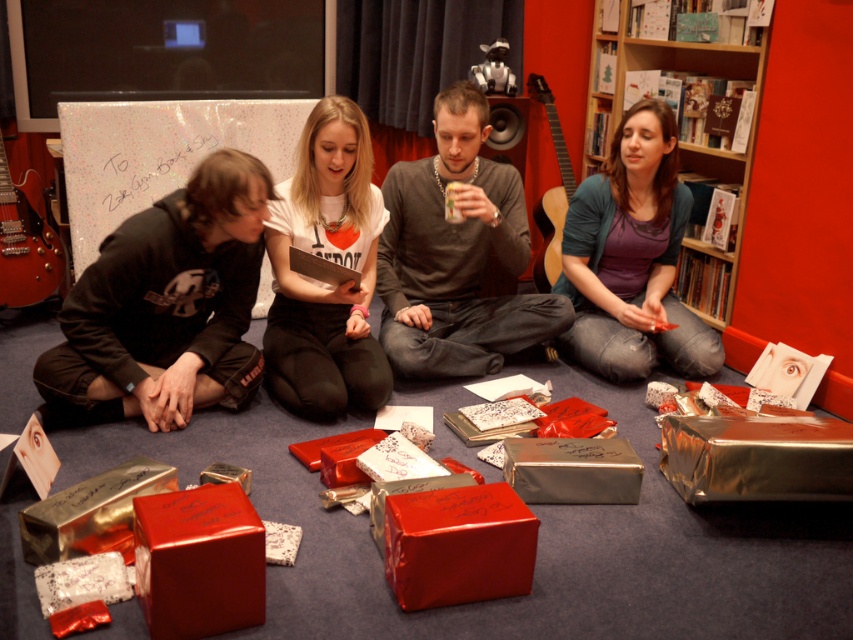
Between matte black hoodie at left and wooden bookshelf at upper center, which one appears on the left side from the viewer's perspective?

From the viewer's perspective, matte black hoodie at left appears more on the left side.

Is matte black hoodie at left bigger than wooden bookshelf at upper center?

No.

Between point (149, 273) and point (650, 67), which one is positioned behind?

Point (650, 67)

The width and height of the screenshot is (853, 640). I want to click on matte black hoodie at left, so click(x=166, y=305).

Where is `matte purple shirt at center`? The width and height of the screenshot is (853, 640). matte purple shirt at center is located at coordinates (631, 259).

Is matte purple shirt at center wider than shiny red box at center?

Correct, the width of matte purple shirt at center exceeds that of shiny red box at center.

Where is `matte purple shirt at center`? matte purple shirt at center is located at coordinates (631, 259).

Between point (155, 388) and point (445, 323), which one is positioned behind?

Positioned behind is point (445, 323).

The image size is (853, 640). Describe the element at coordinates (166, 305) in the screenshot. I see `matte black hoodie at left` at that location.

This screenshot has height=640, width=853. Identify the location of matte black hoodie at left. (166, 305).